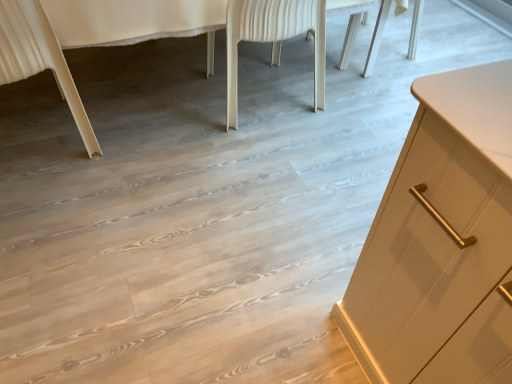
This screenshot has height=384, width=512. Find the location of `free space that is in between white glossy cabinet at right and white wood chair at center, marked as the 1th chair in a right-to-left arrangement`. free space that is in between white glossy cabinet at right and white wood chair at center, marked as the 1th chair in a right-to-left arrangement is located at coordinates (237, 122).